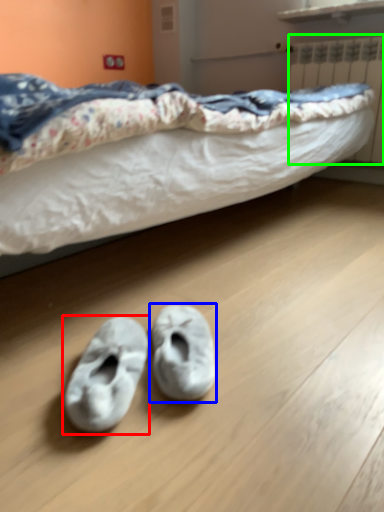
Question: Which object is positioned closest to footwear (highlighted by a red box)? Select from footwear (highlighted by a blue box) and radiator (highlighted by a green box).

Choices:
 (A) footwear
 (B) radiator

Answer: (A)